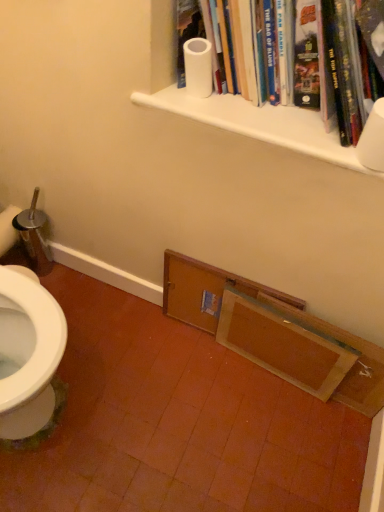
Where is `vacant area that is situated to the right of white matte toilet paper at upper center, which is the 1th toilet paper in top-to-bottom order`? The height and width of the screenshot is (512, 384). vacant area that is situated to the right of white matte toilet paper at upper center, which is the 1th toilet paper in top-to-bottom order is located at coordinates (263, 109).